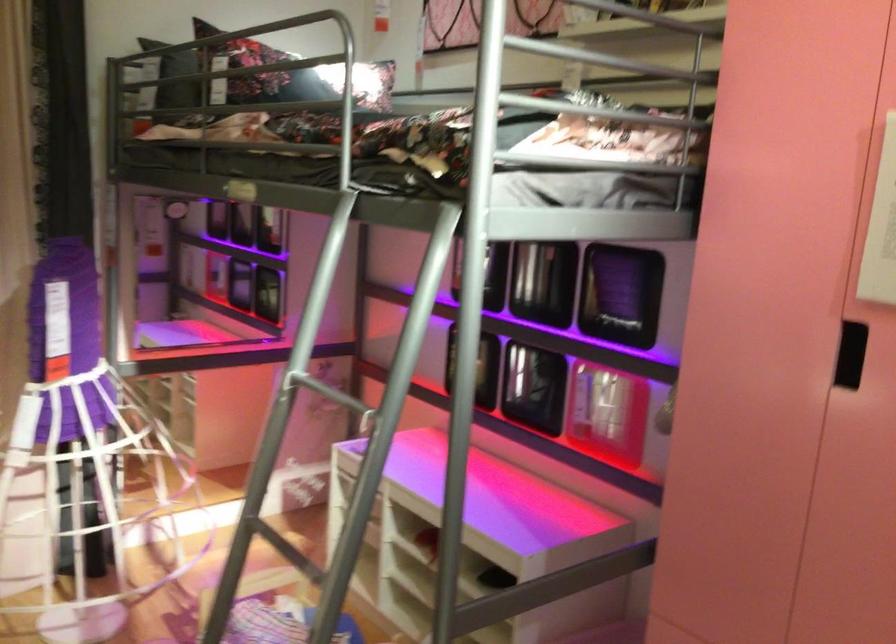
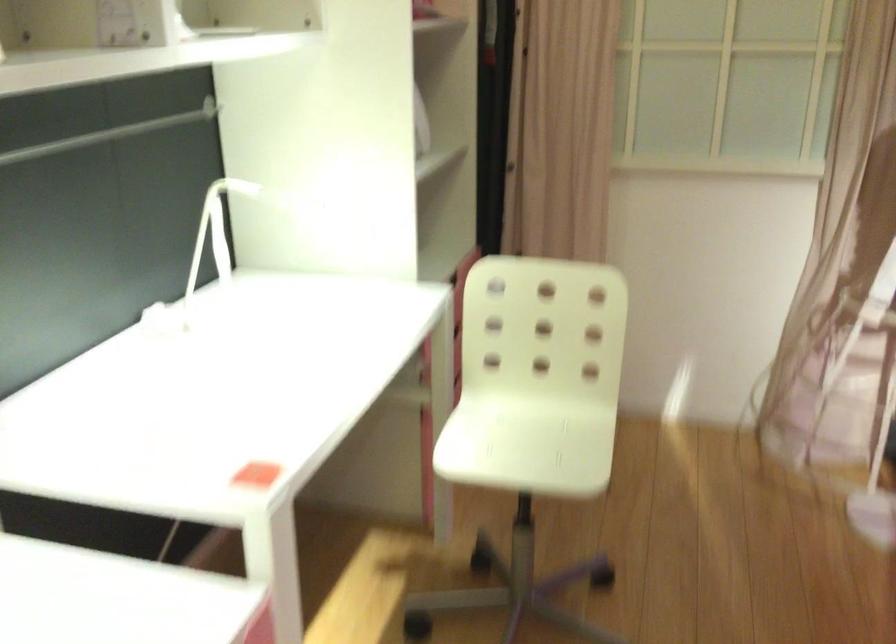
Question: The camera is either moving clockwise (left) or counter-clockwise (right) around the object. The first image is from the beginning of the video and the second image is from the end. Is the camera moving left or right when shooting the video?

Choices:
 (A) Left
 (B) Right

Answer: (B)